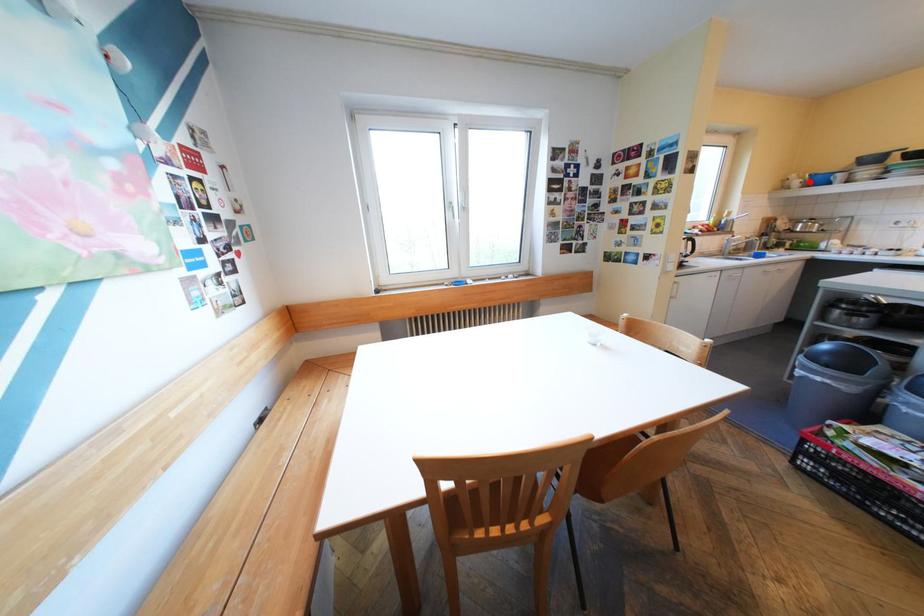
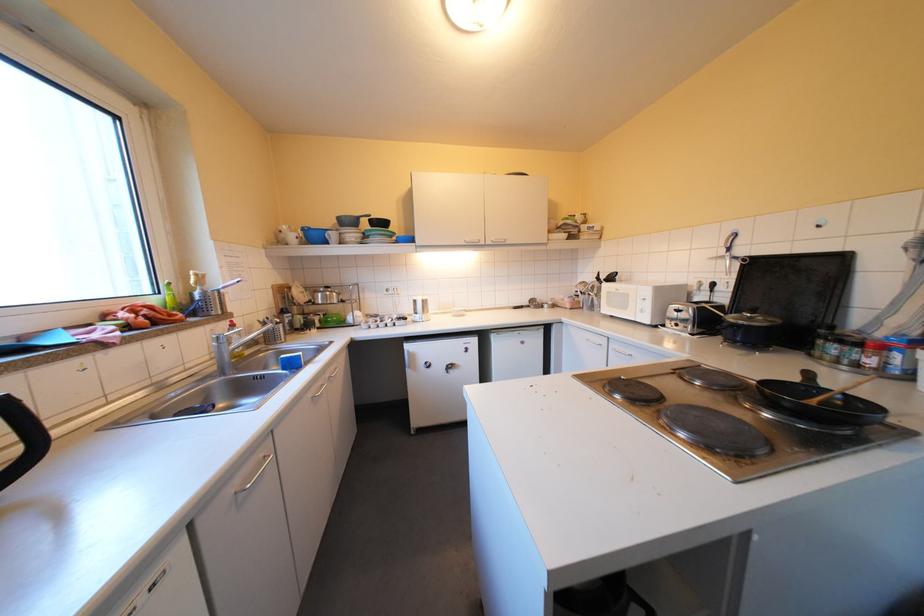
In the second image, find the point that corresponds to the highlighted location in the first image.

(305, 236)